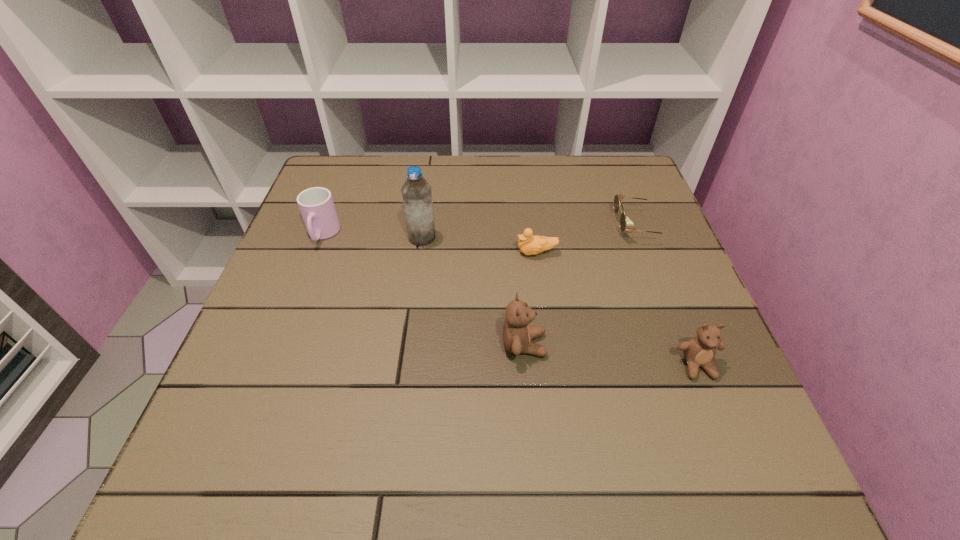
The teddy bears are evenly distributed in the image. To maintain this, where would you place another teddy bear on the left? Please point to a free space. Please provide its 2D coordinates. Your answer should be formatted as a tuple, i.e. [(x, y)], where the tuple contains the x and y coordinates of a point satisfying the conditions above.

[(364, 326)]